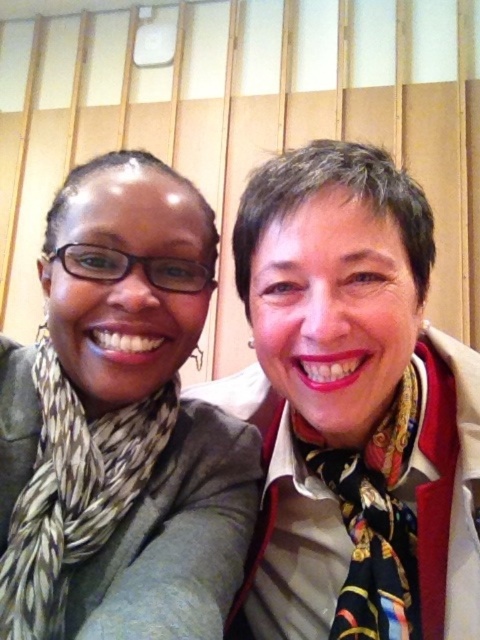
Question: Does printed silk scarf at left lie in front of multicolored silk scarf at center?

Choices:
 (A) yes
 (B) no

Answer: (A)

Question: Which point is farther from the camera taking this photo?

Choices:
 (A) (9, 592)
 (B) (395, 554)

Answer: (B)

Question: Observing the image, what is the correct spatial positioning of printed silk scarf at left in reference to multicolored silk scarf at center?

Choices:
 (A) above
 (B) below

Answer: (A)

Question: Can you confirm if printed silk scarf at left is positioned to the right of multicolored silk scarf at center?

Choices:
 (A) no
 (B) yes

Answer: (A)

Question: Which object appears farthest from the camera in this image?

Choices:
 (A) printed silk scarf at left
 (B) multicolored silk scarf at center

Answer: (B)